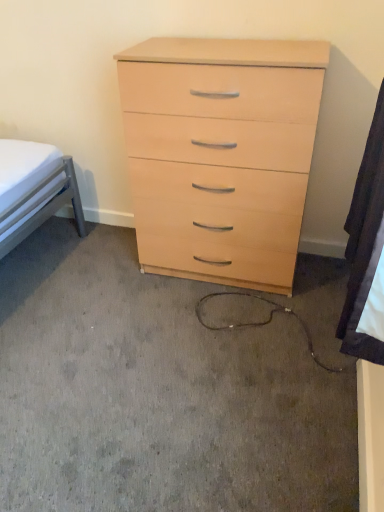
I want to click on vacant region in front of light wood/finish chest of drawers at center, so point(231,342).